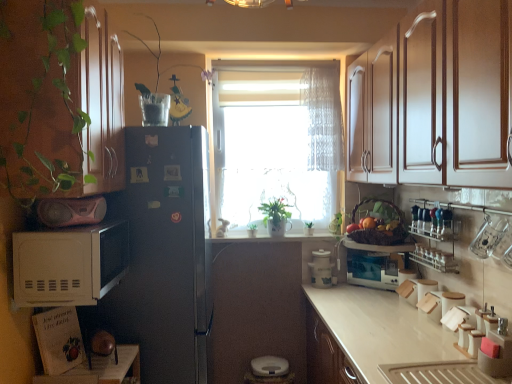
The height and width of the screenshot is (384, 512). What are the coordinates of `vacant space situated on the left part of white plastic soap dispenser at lower right, acting as the fourth appliance starting from the left` in the screenshot? It's located at (450, 369).